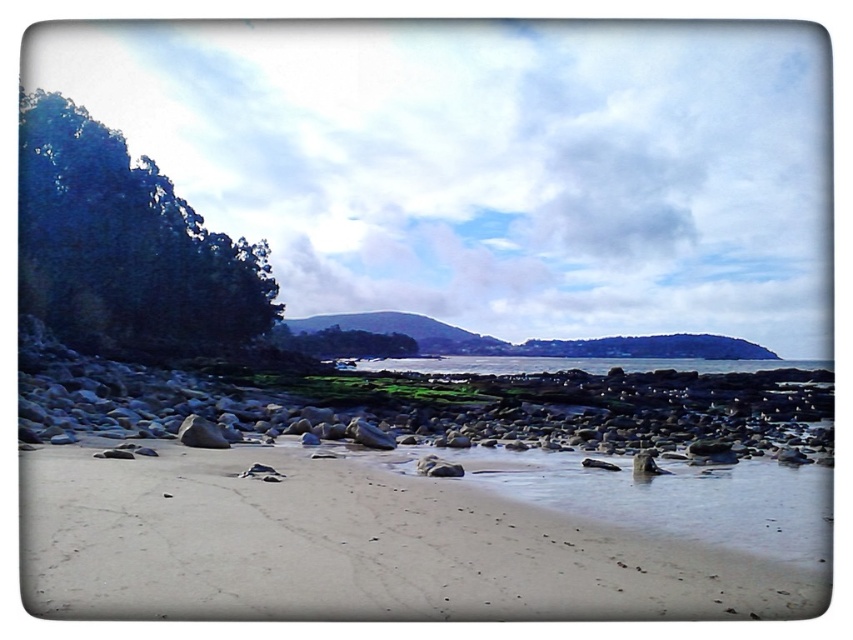
You are standing on the sandy beach at lower center and want to reach the clear blue water at center. Based on the scene description, which direction should you move to reach the water?

The sandy beach at lower center is positioned over clear blue water at center, so you should move downward towards the clear blue water at center to reach it.

You are standing at the origin point of the image coordinate system. You want to walk to the sandy beach at lower center. Which direction should you walk? Please answer with a direction such as north, south, east, west, northeast, etc. Assume the coordinate system is standard with x increasing to the right and y increasing downward.

The sandy beach at lower center is located at coordinate point (352, 545). Since the y coordinate is 0.414, which is closer to the bottom of the image, you should walk south to reach it.